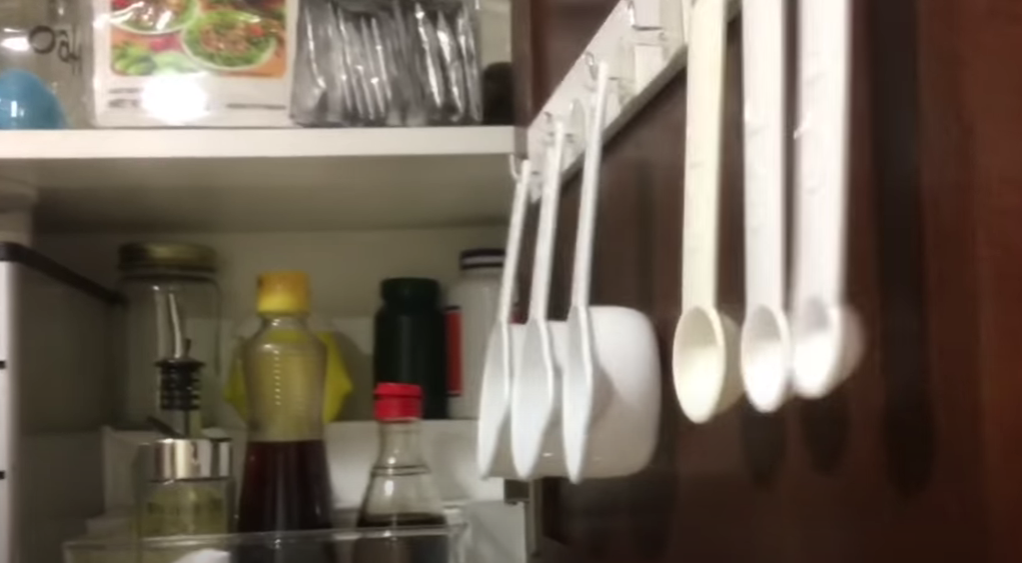
Locate an element on the screen. This screenshot has width=1022, height=563. brown wall is located at coordinates (918, 401).